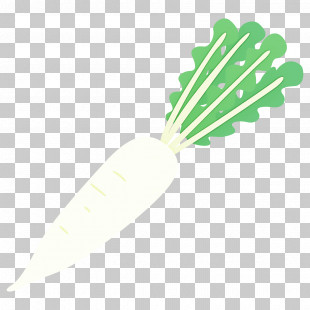
Locate an element on the screen. The image size is (310, 310). table is located at coordinates (100, 62).